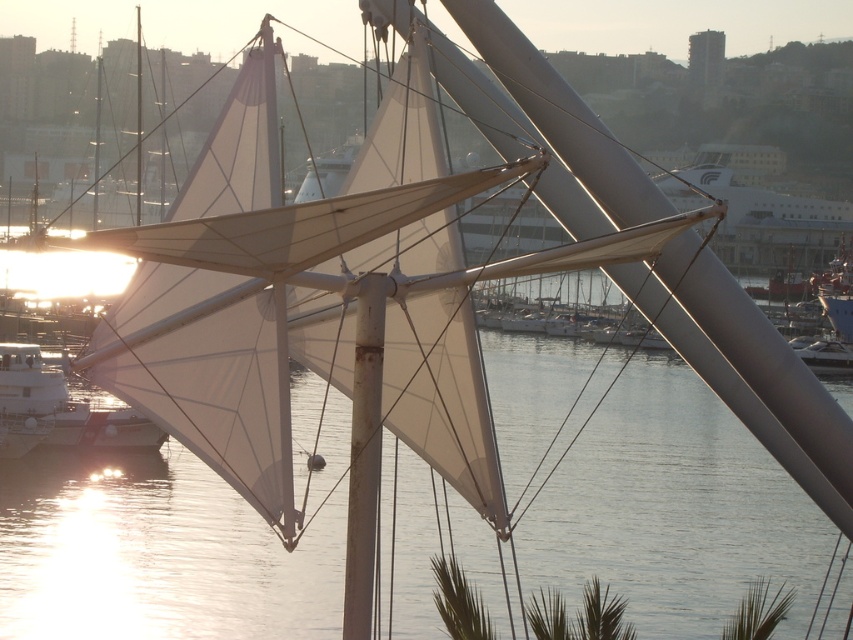
Does point (103, 563) come farther from viewer compared to point (10, 355)?

No, it is in front of (10, 355).

Is the position of transparent water at center less distant than that of white matte sailboat at lower left?

Yes.

What do you see at coordinates (672, 509) in the screenshot? This screenshot has height=640, width=853. I see `transparent water at center` at bounding box center [672, 509].

At what (x,y) coordinates should I click in order to perform the action: click on transparent water at center. Please return your answer as a coordinate pair (x, y). This screenshot has height=640, width=853. Looking at the image, I should click on pos(672,509).